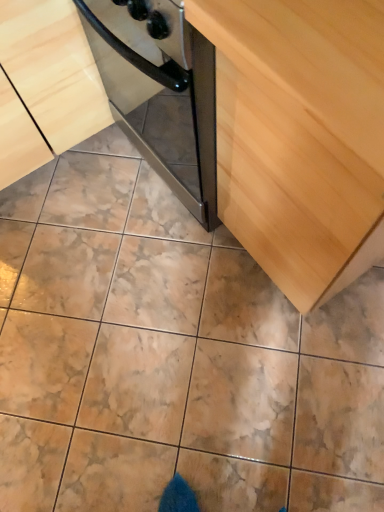
What do you see at coordinates (45, 85) in the screenshot? The height and width of the screenshot is (512, 384). I see `light wood cabinet at center, which is the 2th cabinetry from right to left` at bounding box center [45, 85].

Locate an element on the screen. The image size is (384, 512). light wood cabinet at center, arranged as the 1th cabinetry when viewed from the left is located at coordinates (45, 85).

Identify the location of light wood cabinet at center, arranged as the second cabinetry when viewed from the left. This screenshot has width=384, height=512. (300, 136).

Describe the element at coordinates (300, 136) in the screenshot. This screenshot has width=384, height=512. I see `light wood cabinet at center, the first cabinetry from the right` at that location.

Locate an element on the screen. light wood cabinet at center, arranged as the 1th cabinetry when viewed from the left is located at coordinates (45, 85).

Can you confirm if light wood cabinet at center, the first cabinetry from the right, is positioned to the left of light wood cabinet at center, arranged as the 1th cabinetry when viewed from the left?

In fact, light wood cabinet at center, the first cabinetry from the right, is to the right of light wood cabinet at center, arranged as the 1th cabinetry when viewed from the left.

From the picture: Considering their positions, is light wood cabinet at center, arranged as the second cabinetry when viewed from the left, located in front of or behind light wood cabinet at center, arranged as the 1th cabinetry when viewed from the left?

In the image, light wood cabinet at center, arranged as the second cabinetry when viewed from the left, appears in front of light wood cabinet at center, arranged as the 1th cabinetry when viewed from the left.

Is point (350, 39) closer to viewer compared to point (24, 44)?

Yes.

From the image's perspective, is light wood cabinet at center, arranged as the second cabinetry when viewed from the left, located beneath light wood cabinet at center, which is the 2th cabinetry from right to left?

Yes, from the image's perspective, light wood cabinet at center, arranged as the second cabinetry when viewed from the left, is below light wood cabinet at center, which is the 2th cabinetry from right to left.

From a real-world perspective, relative to light wood cabinet at center, which is the 2th cabinetry from right to left, is light wood cabinet at center, arranged as the second cabinetry when viewed from the left, vertically above or below?

Clearly, from a real-world perspective, light wood cabinet at center, arranged as the second cabinetry when viewed from the left, is above light wood cabinet at center, which is the 2th cabinetry from right to left.

Considering the relative sizes of light wood cabinet at center, the first cabinetry from the right, and light wood cabinet at center, arranged as the 1th cabinetry when viewed from the left, in the image provided, is light wood cabinet at center, the first cabinetry from the right, wider than light wood cabinet at center, arranged as the 1th cabinetry when viewed from the left,?

Yes.

In the scene shown: Is light wood cabinet at center, the first cabinetry from the right, taller or shorter than light wood cabinet at center, arranged as the 1th cabinetry when viewed from the left?

Considering their sizes, light wood cabinet at center, the first cabinetry from the right, has more height than light wood cabinet at center, arranged as the 1th cabinetry when viewed from the left.

Does light wood cabinet at center, arranged as the second cabinetry when viewed from the left, have a larger size compared to light wood cabinet at center, arranged as the 1th cabinetry when viewed from the left?

Incorrect, light wood cabinet at center, arranged as the second cabinetry when viewed from the left, is not larger than light wood cabinet at center, arranged as the 1th cabinetry when viewed from the left.

Would you say light wood cabinet at center, arranged as the second cabinetry when viewed from the left, is inside or outside light wood cabinet at center, which is the 2th cabinetry from right to left?

light wood cabinet at center, arranged as the second cabinetry when viewed from the left, is not inside light wood cabinet at center, which is the 2th cabinetry from right to left, it's outside.

From the picture: Are light wood cabinet at center, arranged as the second cabinetry when viewed from the left, and light wood cabinet at center, arranged as the 1th cabinetry when viewed from the left, located far from each other?

No, light wood cabinet at center, arranged as the second cabinetry when viewed from the left, is not far from light wood cabinet at center, arranged as the 1th cabinetry when viewed from the left.

Consider the image. Is light wood cabinet at center, which is the 2th cabinetry from right to left, at the back of light wood cabinet at center, the first cabinetry from the right?

No, light wood cabinet at center, the first cabinetry from the right, is not facing away from light wood cabinet at center, which is the 2th cabinetry from right to left.

How many degrees apart are the facing directions of light wood cabinet at center, arranged as the second cabinetry when viewed from the left, and light wood cabinet at center, which is the 2th cabinetry from right to left?

The facing directions of light wood cabinet at center, arranged as the second cabinetry when viewed from the left, and light wood cabinet at center, which is the 2th cabinetry from right to left, are 89 degrees apart.

Find the location of a particular element. cabinetry below the light wood cabinet at center, which is the 2th cabinetry from right to left (from the image's perspective) is located at coordinates (300, 136).

Based on their positions, is light wood cabinet at center, which is the 2th cabinetry from right to left, located to the left or right of light wood cabinet at center, the first cabinetry from the right?

light wood cabinet at center, which is the 2th cabinetry from right to left, is to the left of light wood cabinet at center, the first cabinetry from the right.

Is the depth of light wood cabinet at center, arranged as the 1th cabinetry when viewed from the left, less than that of light wood cabinet at center, arranged as the second cabinetry when viewed from the left?

No, light wood cabinet at center, arranged as the 1th cabinetry when viewed from the left, is behind light wood cabinet at center, arranged as the second cabinetry when viewed from the left.

Does point (32, 167) lie in front of point (328, 166)?

No, it is not.

From the image's perspective, is light wood cabinet at center, which is the 2th cabinetry from right to left, on light wood cabinet at center, the first cabinetry from the right?

Indeed, from the image's perspective, light wood cabinet at center, which is the 2th cabinetry from right to left, is shown above light wood cabinet at center, the first cabinetry from the right.

From a real-world perspective, which is physically below, light wood cabinet at center, which is the 2th cabinetry from right to left, or light wood cabinet at center, the first cabinetry from the right?

In real-world perspective, light wood cabinet at center, which is the 2th cabinetry from right to left, is lower.

Considering the sizes of light wood cabinet at center, arranged as the 1th cabinetry when viewed from the left, and light wood cabinet at center, the first cabinetry from the right, in the image, is light wood cabinet at center, arranged as the 1th cabinetry when viewed from the left, wider or thinner than light wood cabinet at center, the first cabinetry from the right,?

In the image, light wood cabinet at center, arranged as the 1th cabinetry when viewed from the left, appears to be more narrow than light wood cabinet at center, the first cabinetry from the right.

Which of these two, light wood cabinet at center, which is the 2th cabinetry from right to left, or light wood cabinet at center, arranged as the second cabinetry when viewed from the left, stands taller?

With more height is light wood cabinet at center, arranged as the second cabinetry when viewed from the left.

Between light wood cabinet at center, which is the 2th cabinetry from right to left, and light wood cabinet at center, arranged as the second cabinetry when viewed from the left, which one has smaller size?

light wood cabinet at center, arranged as the second cabinetry when viewed from the left.

Is light wood cabinet at center, which is the 2th cabinetry from right to left, not inside light wood cabinet at center, the first cabinetry from the right?

Absolutely, light wood cabinet at center, which is the 2th cabinetry from right to left, is external to light wood cabinet at center, the first cabinetry from the right.

Is light wood cabinet at center, arranged as the 1th cabinetry when viewed from the left, placed right next to light wood cabinet at center, arranged as the second cabinetry when viewed from the left?

No, light wood cabinet at center, arranged as the 1th cabinetry when viewed from the left, is not in contact with light wood cabinet at center, arranged as the second cabinetry when viewed from the left.

Is light wood cabinet at center, which is the 2th cabinetry from right to left, aimed at light wood cabinet at center, arranged as the second cabinetry when viewed from the left?

Yes, light wood cabinet at center, which is the 2th cabinetry from right to left, is facing light wood cabinet at center, arranged as the second cabinetry when viewed from the left.

How many degrees apart are the facing directions of light wood cabinet at center, arranged as the 1th cabinetry when viewed from the left, and light wood cabinet at center, arranged as the second cabinetry when viewed from the left?

The angular difference between light wood cabinet at center, arranged as the 1th cabinetry when viewed from the left, and light wood cabinet at center, arranged as the second cabinetry when viewed from the left, is 89 degrees.

This screenshot has width=384, height=512. I want to click on cabinetry on the left of light wood cabinet at center, the first cabinetry from the right, so click(45, 85).

Find the location of `cabinetry behind the light wood cabinet at center, arranged as the second cabinetry when viewed from the left`. cabinetry behind the light wood cabinet at center, arranged as the second cabinetry when viewed from the left is located at coordinates (45, 85).

In the image, there is a light wood cabinet at center, arranged as the second cabinetry when viewed from the left. Identify the location of cabinetry above it (from the image's perspective). (45, 85).